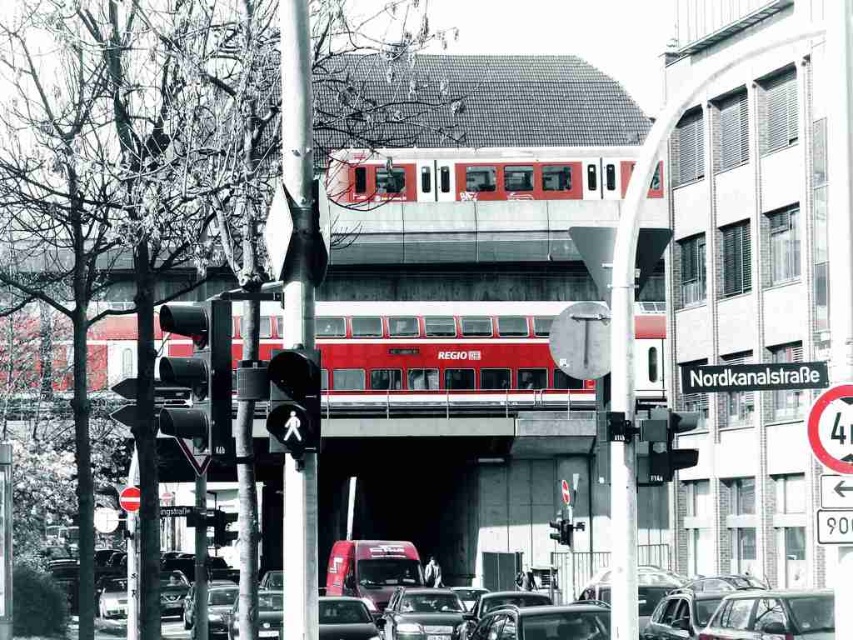
Can you confirm if matte red train at center is thinner than black matte traffic light at center?

In fact, matte red train at center might be wider than black matte traffic light at center.

Between matte red train at center and black matte traffic light at center, which one is positioned lower?

black matte traffic light at center

At what (x,y) coordinates should I click in order to perform the action: click on matte red train at center. Please return your answer as a coordinate pair (x, y). This screenshot has height=640, width=853. Looking at the image, I should click on (479, 173).

Identify the location of matte red train at center. The height and width of the screenshot is (640, 853). (479, 173).

Is matte red train at center below metallic pole at center?

No, matte red train at center is not below metallic pole at center.

Identify the location of matte red train at center. The width and height of the screenshot is (853, 640). (479, 173).

Identify the location of matte red train at center. This screenshot has height=640, width=853. (479, 173).

In order to click on matte red train at center in this screenshot , I will do `click(479, 173)`.

Does metallic pole at center have a larger size compared to shiny silver sedan at center?

Yes.

Can you confirm if metallic pole at center is shorter than shiny silver sedan at center?

No, metallic pole at center is not shorter than shiny silver sedan at center.

Does point (299, 512) come closer to viewer compared to point (407, 632)?

Yes, point (299, 512) is closer to viewer.

Locate an element on the screen. The height and width of the screenshot is (640, 853). metallic pole at center is located at coordinates (296, 170).